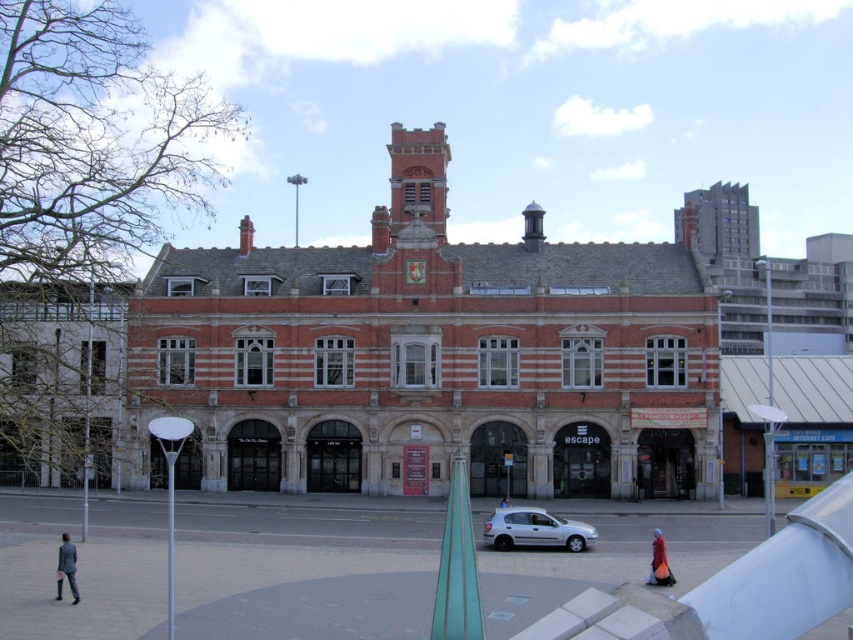
Question: Does silver metallic car at lower center come behind red velvet dress at lower right?

Choices:
 (A) yes
 (B) no

Answer: (A)

Question: Does silver metallic car at lower center have a greater width compared to red velvet dress at lower right?

Choices:
 (A) no
 (B) yes

Answer: (B)

Question: Among these objects, which one is nearest to the camera?

Choices:
 (A) red velvet dress at lower right
 (B) silver metallic car at lower center

Answer: (A)

Question: Can you confirm if dark gray suit at lower left is positioned above red velvet dress at lower right?

Choices:
 (A) no
 (B) yes

Answer: (B)

Question: Which point is closer to the camera?

Choices:
 (A) red velvet dress at lower right
 (B) dark gray suit at lower left
 (C) silver metallic car at lower center

Answer: (B)

Question: Which object is closer to the camera taking this photo?

Choices:
 (A) silver metallic car at lower center
 (B) red velvet dress at lower right

Answer: (B)